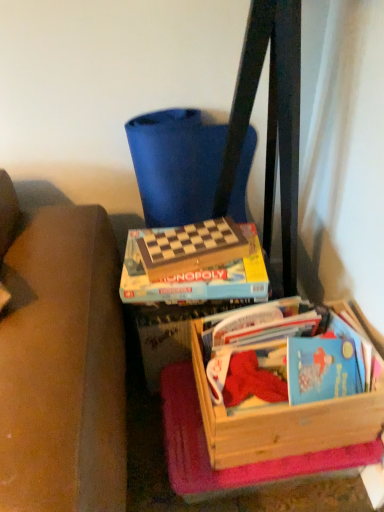
The width and height of the screenshot is (384, 512). Find the location of `vacant space situated above wooden paperback book at center (from a real-world perspective)`. vacant space situated above wooden paperback book at center (from a real-world perspective) is located at coordinates (186, 239).